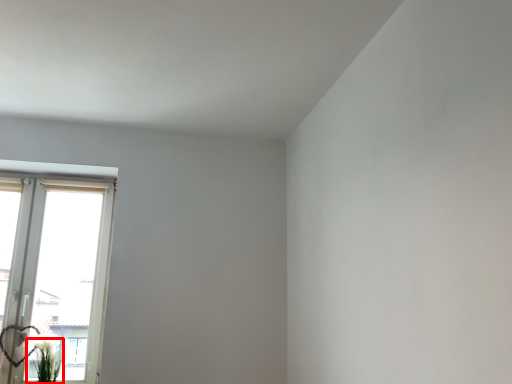
Question: From the image's perspective, where is plant (annotated by the red box) located in relation to window in the image?

Choices:
 (A) below
 (B) above

Answer: (A)